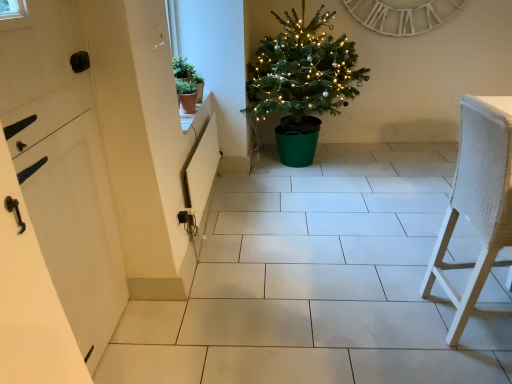
Question: Is green plastic christmas tree at center beside white wooden clock at upper center?

Choices:
 (A) no
 (B) yes

Answer: (A)

Question: Can you confirm if green plastic christmas tree at center is thinner than white wooden clock at upper center?

Choices:
 (A) no
 (B) yes

Answer: (A)

Question: From a real-world perspective, is green plastic christmas tree at center located beneath white wooden clock at upper center?

Choices:
 (A) yes
 (B) no

Answer: (A)

Question: Is green plastic christmas tree at center positioned in front of white wooden clock at upper center?

Choices:
 (A) no
 (B) yes

Answer: (B)

Question: Is green plastic christmas tree at center to the left of white wooden clock at upper center from the viewer's perspective?

Choices:
 (A) yes
 (B) no

Answer: (A)

Question: Is white wooden clock at upper center taller or shorter than green matte pot at upper left, placed as the second houseplant when sorted from top to bottom?

Choices:
 (A) tall
 (B) short

Answer: (A)

Question: Do you think white wooden clock at upper center is within green matte pot at upper left, placed as the second houseplant when sorted from top to bottom, or outside of it?

Choices:
 (A) inside
 (B) outside

Answer: (B)

Question: From a real-world perspective, is white wooden clock at upper center physically located above or below green matte pot at upper left, arranged as the first houseplant when ordered from the bottom?

Choices:
 (A) below
 (B) above

Answer: (B)

Question: Is point (438, 3) positioned closer to the camera than point (194, 104)?

Choices:
 (A) closer
 (B) farther

Answer: (B)

Question: In terms of height, does green matte plant pot at upper left, the 1th houseplant from the top, look taller or shorter compared to green plastic christmas tree at center?

Choices:
 (A) tall
 (B) short

Answer: (B)

Question: In the image, is green matte plant pot at upper left, which is the second houseplant in bottom-to-top order, on the left side or the right side of green plastic christmas tree at center?

Choices:
 (A) right
 (B) left

Answer: (B)

Question: Relative to green plastic christmas tree at center, is green matte plant pot at upper left, which is the second houseplant in bottom-to-top order, in front or behind?

Choices:
 (A) behind
 (B) front

Answer: (B)

Question: From the image's perspective, is green matte plant pot at upper left, the 1th houseplant from the top, above or below green plastic christmas tree at center?

Choices:
 (A) above
 (B) below

Answer: (B)

Question: Considering the positions of green matte plant pot at upper left, which is the second houseplant in bottom-to-top order, and white painted wood door at left in the image, is green matte plant pot at upper left, which is the second houseplant in bottom-to-top order, taller or shorter than white painted wood door at left?

Choices:
 (A) short
 (B) tall

Answer: (A)

Question: From a real-world perspective, is green matte plant pot at upper left, the 1th houseplant from the top, physically located above or below white painted wood door at left?

Choices:
 (A) above
 (B) below

Answer: (A)